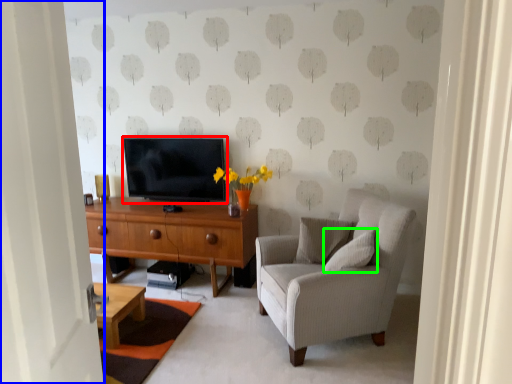
Question: Estimate the real-world distances between objects in this image. Which object is farther from television (highlighted by a red box), door (highlighted by a blue box) or pillow (highlighted by a green box)?

Choices:
 (A) door
 (B) pillow

Answer: (A)